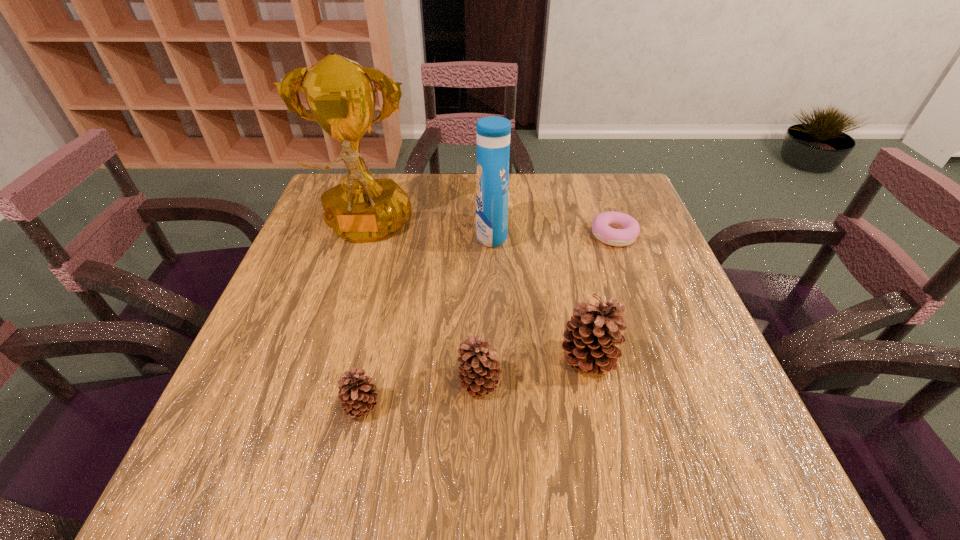
Find the location of `the shortest pinecone`. the shortest pinecone is located at coordinates (356, 393).

The height and width of the screenshot is (540, 960). I want to click on the fifth tallest object, so click(x=356, y=393).

What are the coordinates of `the second tallest pinecone` in the screenshot? It's located at (478, 373).

This screenshot has width=960, height=540. I want to click on the fourth tallest object, so click(x=478, y=373).

Image resolution: width=960 pixels, height=540 pixels. In order to click on the rightmost pinecone in this screenshot , I will do `click(590, 337)`.

The height and width of the screenshot is (540, 960). I want to click on the fourth shortest object, so click(590, 337).

Where is `the rightmost object`? the rightmost object is located at coordinates (603, 227).

Where is `pastry`? The width and height of the screenshot is (960, 540). pastry is located at coordinates (603, 227).

This screenshot has width=960, height=540. Identify the location of the second tallest object. (493, 133).

Find the location of a particular element. The image size is (960, 540). award is located at coordinates (340, 94).